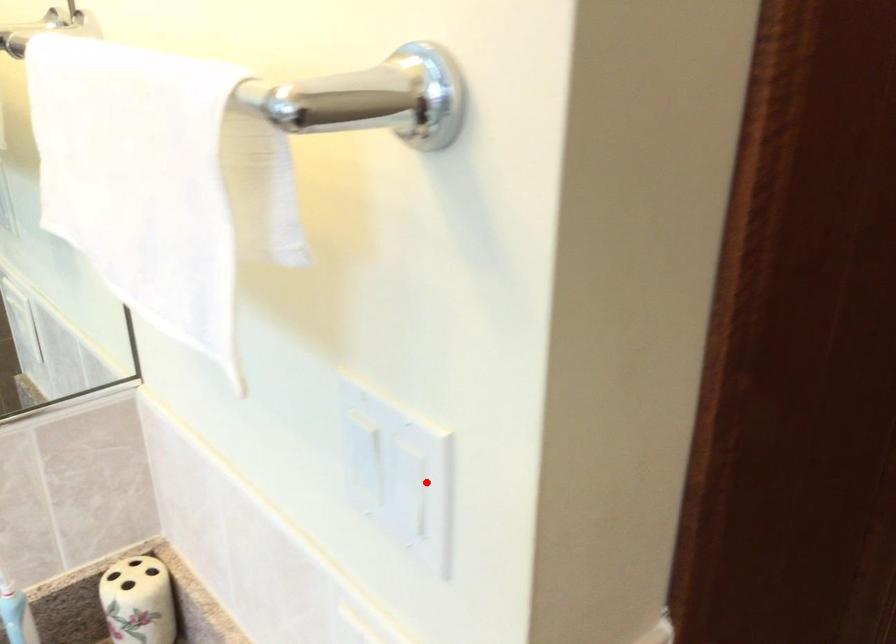
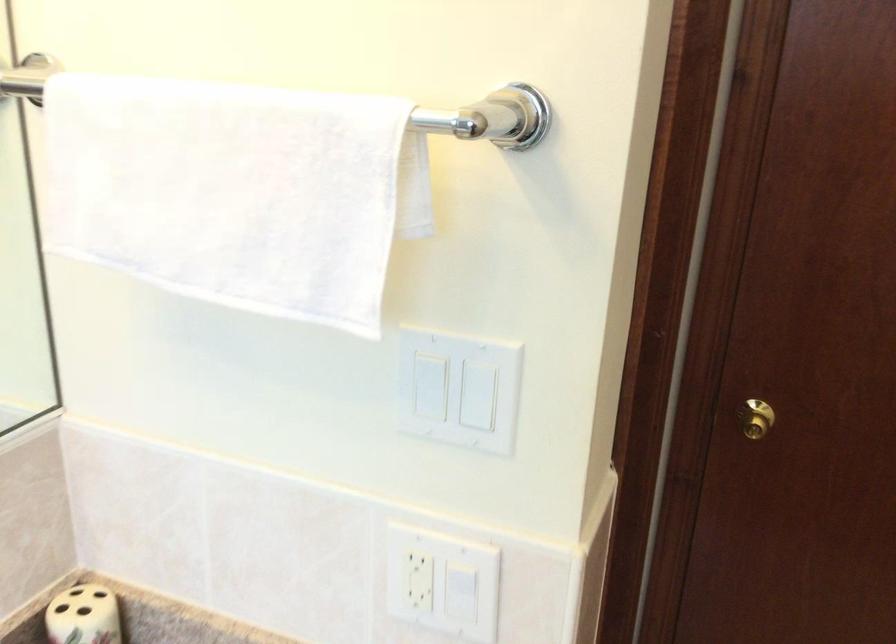
Question: I am providing you with two images of the same scene from different viewpoints. A red point is marked on the first image. At the location where the point appears in image 1, is it still visible in image 2?

Choices:
 (A) Yes
 (B) No

Answer: (A)